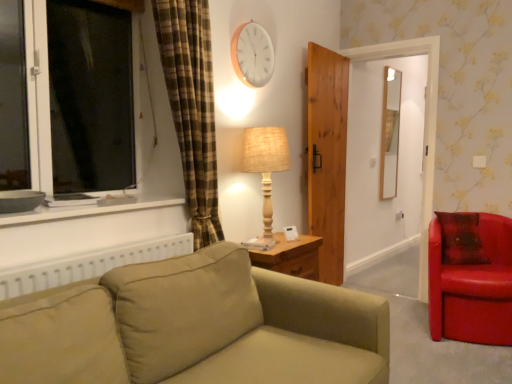
Identify the location of free location in front of shiny leather armchair at right. (470, 361).